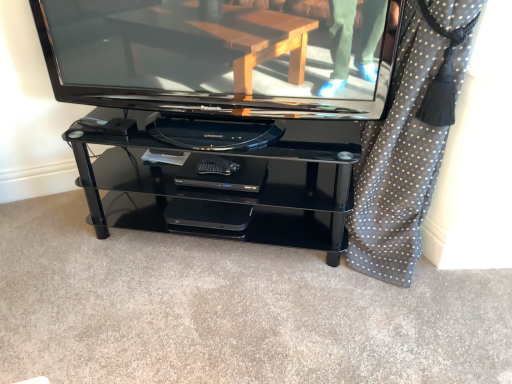
What is the approximate height of glossy black television at center?

glossy black television at center is 19.72 inches in height.

Identify the location of polka dot fabric at right. The height and width of the screenshot is (384, 512). (398, 162).

Where is `glossy black television at center`? This screenshot has height=384, width=512. glossy black television at center is located at coordinates (220, 56).

Is black plastic dvd player at center located outside glossy black television at center?

Indeed, black plastic dvd player at center is completely outside glossy black television at center.

From the picture: Considering the relative sizes of black plastic dvd player at center and glossy black television at center in the image provided, is black plastic dvd player at center smaller than glossy black television at center?

Yes, black plastic dvd player at center is smaller than glossy black television at center.

Can you confirm if black plastic dvd player at center is positioned to the left of glossy black television at center?

No, black plastic dvd player at center is not to the left of glossy black television at center.

Can you confirm if black plastic dvd player at center is taller than glossy black television at center?

No, black plastic dvd player at center is not taller than glossy black television at center.

Consider the image. Is glossy black television at center in front of or behind polka dot fabric at right in the image?

In the image, glossy black television at center appears behind polka dot fabric at right.

Between glossy black television at center and polka dot fabric at right, which one has larger width?

polka dot fabric at right.

How far apart are glossy black television at center and polka dot fabric at right?

A distance of 16.88 inches exists between glossy black television at center and polka dot fabric at right.

In the scene shown: Is polka dot fabric at right at the back of glossy black television at center?

glossy black television at center does not have its back to polka dot fabric at right.

In terms of width, does polka dot fabric at right look wider or thinner when compared to glossy black television at center?

Considering their sizes, polka dot fabric at right looks broader than glossy black television at center.

Is polka dot fabric at right looking in the opposite direction of glossy black television at center?

polka dot fabric at right does not have its back to glossy black television at center.

From a real-world perspective, which is physically below, polka dot fabric at right or glossy black television at center?

From a 3D spatial view, polka dot fabric at right is below.

Does point (423, 207) come in front of point (70, 32)?

No, (423, 207) is behind (70, 32).

Is glossy black television at center in front of black plastic dvd player at center?

Yes, it is.

Considering the relative sizes of glossy black television at center and black plastic dvd player at center in the image provided, is glossy black television at center thinner than black plastic dvd player at center?

Yes, glossy black television at center is thinner than black plastic dvd player at center.

Can black plastic dvd player at center be found inside glossy black television at center?

No, black plastic dvd player at center is not surrounded by glossy black television at center.

Are black plastic dvd player at center and polka dot fabric at right far apart?

That's not correct — black plastic dvd player at center is a little close to polka dot fabric at right.

Between point (215, 177) and point (388, 123), which one is positioned behind?

The point (215, 177) is farther from the camera.

Relative to polka dot fabric at right, is black plastic dvd player at center in front or behind?

In the image, black plastic dvd player at center appears behind polka dot fabric at right.

Is black plastic dvd player at center inside or outside of polka dot fabric at right?

black plastic dvd player at center is outside polka dot fabric at right.

From the picture: What's the angular difference between polka dot fabric at right and black plastic dvd player at center's facing directions?

polka dot fabric at right and black plastic dvd player at center are facing 18.1 degrees away from each other.

Is point (394, 227) closer or farther from the camera than point (176, 179)?

Point (394, 227) is positioned closer to the camera compared to point (176, 179).

From the image's perspective, which one is positioned lower, polka dot fabric at right or black plastic dvd player at center?

black plastic dvd player at center is shown below in the image.

Is polka dot fabric at right closer to the viewer compared to black plastic dvd player at center?

Yes, polka dot fabric at right is closer to the camera.

Where is `footrest lying on the right of glossy black television at center`? footrest lying on the right of glossy black television at center is located at coordinates (222, 173).

You are a GUI agent. You are given a task and a screenshot of the screen. Output one action in this format:
    pyautogui.click(x=<x>, y=<y>)
    Task: Click on the curtain that is below the glossy black television at center (from the image's perspective)
    
    Given the screenshot: What is the action you would take?
    pyautogui.click(x=398, y=162)

When comparing their distances from black plastic dvd player at center, does glossy black television at center or polka dot fabric at right seem further?

Based on the image, polka dot fabric at right appears to be further to black plastic dvd player at center.

Looking at this image, when comparing their distances from glossy black television at center, does polka dot fabric at right or black plastic dvd player at center seem further?

polka dot fabric at right is further to glossy black television at center.

Estimate the real-world distances between objects in this image. Which object is further from glossy black television at center, black plastic dvd player at center or polka dot fabric at right?

polka dot fabric at right lies further to glossy black television at center than the other object.

From the image, which object appears to be farther from black plastic dvd player at center, polka dot fabric at right or glossy black television at center?

Based on the image, polka dot fabric at right appears to be further to black plastic dvd player at center.

Estimate the real-world distances between objects in this image. Which object is closer to polka dot fabric at right, black plastic dvd player at center or glossy black television at center?

Answer: Among the two, glossy black television at center is located nearer to polka dot fabric at right.

Based on their spatial positions, is glossy black television at center or black plastic dvd player at center further from polka dot fabric at right?

black plastic dvd player at center is further to polka dot fabric at right.

Locate an element on the screen. footrest between glossy black television at center and polka dot fabric at right from left to right is located at coordinates (222, 173).